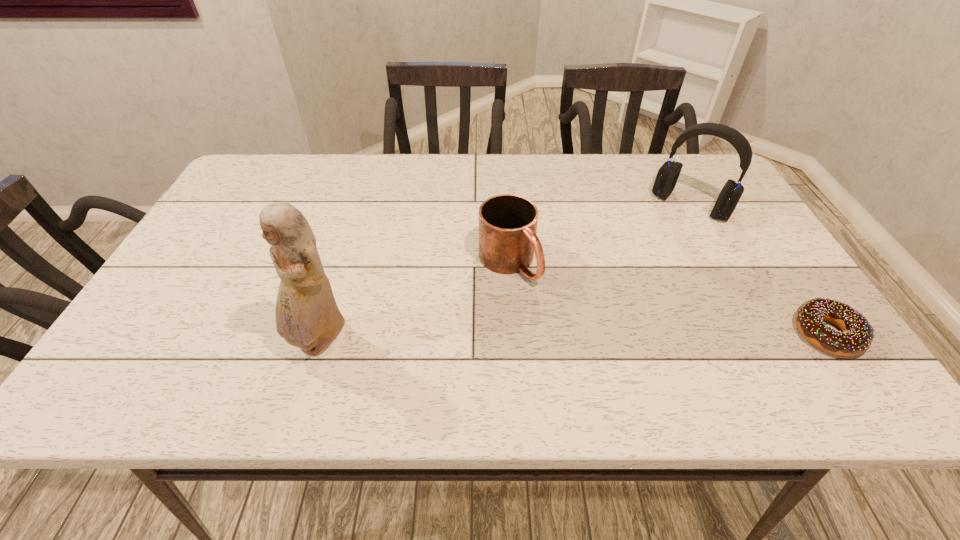
You are a GUI agent. You are given a task and a screenshot of the screen. Output one action in this format:
    pyautogui.click(x=<x>, y=<y>)
    Task: Click on the vacant space that's between the second tallest object and the second object from left to right
    This screenshot has height=540, width=960.
    Given the screenshot: What is the action you would take?
    pyautogui.click(x=599, y=234)

Locate an element on the screen. The width and height of the screenshot is (960, 540). free point between the farthest object and the third tallest object is located at coordinates (599, 234).

Select which object appears as the third closest to the leftmost object. Please provide its 2D coordinates. Your answer should be formatted as a tuple, i.e. [(x, y)], where the tuple contains the x and y coordinates of a point satisfying the conditions above.

[(857, 337)]

Identify which object is the third nearest to the second tallest object. Please provide its 2D coordinates. Your answer should be formatted as a tuple, i.e. [(x, y)], where the tuple contains the x and y coordinates of a point satisfying the conditions above.

[(307, 316)]